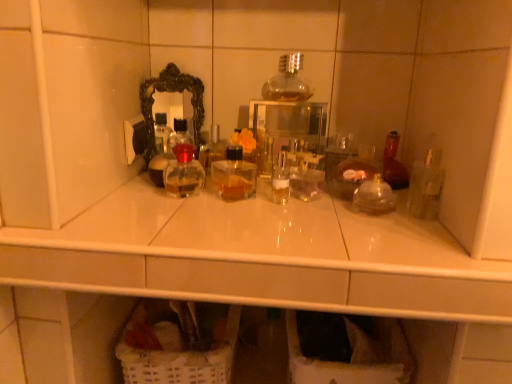
What do you see at coordinates (346, 349) in the screenshot? This screenshot has width=512, height=384. I see `white wicker laundry basket at lower center` at bounding box center [346, 349].

What do you see at coordinates (286, 128) in the screenshot? I see `transparent glass medicine cabinet at center` at bounding box center [286, 128].

Image resolution: width=512 pixels, height=384 pixels. In order to click on white wicker laundry basket at lower center in this screenshot , I will do `click(346, 349)`.

Considering the relative positions of clear glass bottle at center and transparent glass medicine cabinet at center in the image provided, is clear glass bottle at center to the right of transparent glass medicine cabinet at center from the viewer's perspective?

No.

What are the coordinates of `bottle that appears below the transparent glass medicine cabinet at center (from a real-world perspective)` in the screenshot? It's located at (160, 162).

How far apart are clear glass bottle at center and transparent glass medicine cabinet at center?

They are 9.74 inches apart.

Does clear glass bottle at center lie in front of transparent glass medicine cabinet at center?

No.

Is clear glass bottle at center spatially inside black ornate mirror at upper center, or outside of it?

The correct answer is: inside.

Considering the positions of point (170, 154) and point (156, 85), is point (170, 154) closer or farther from the camera than point (156, 85)?

Point (170, 154) appears to be closer to the viewer than point (156, 85).

From the image's perspective, would you say clear glass bottle at center is shown under black ornate mirror at upper center?

Yes, from the image's perspective, clear glass bottle at center is beneath black ornate mirror at upper center.

Is clear glass bottle at center to the left or to the right of black ornate mirror at upper center in the image?

Clearly, clear glass bottle at center is on the left of black ornate mirror at upper center in the image.

What's the angular difference between transparent glass medicine cabinet at center and black ornate mirror at upper center's facing directions?

The angle between the facing direction of transparent glass medicine cabinet at center and the facing direction of black ornate mirror at upper center is 180 degrees.

Considering the points (254, 126) and (191, 90), which point is in front, point (254, 126) or point (191, 90)?

The point (191, 90) is more forward.

The height and width of the screenshot is (384, 512). What are the coordinates of `mirror that is under the transparent glass medicine cabinet at center (from a real-world perspective)` in the screenshot? It's located at (170, 91).

From the image's perspective, is transparent glass medicine cabinet at center under black ornate mirror at upper center?

Yes, from the image's perspective, transparent glass medicine cabinet at center is beneath black ornate mirror at upper center.

Could you tell me if black ornate mirror at upper center is facing clear glass bottle at center?

No, black ornate mirror at upper center is not aimed at clear glass bottle at center.

Would you consider black ornate mirror at upper center to be distant from clear glass bottle at center?

No, black ornate mirror at upper center is not far from clear glass bottle at center.

Is clear glass bottle at center completely or partially inside black ornate mirror at upper center?

Yes, clear glass bottle at center is inside black ornate mirror at upper center.

Which is more to the left, black ornate mirror at upper center or clear glass bottle at center?

From the viewer's perspective, clear glass bottle at center appears more on the left side.

Is clear glass bottle at center not inside white wicker laundry basket at lower center?

Yes, clear glass bottle at center is outside of white wicker laundry basket at lower center.

Is clear glass bottle at center next to white wicker laundry basket at lower center and touching it?

No, clear glass bottle at center is not with white wicker laundry basket at lower center.

Can you confirm if clear glass bottle at center is smaller than white wicker laundry basket at lower center?

Yes, clear glass bottle at center is smaller than white wicker laundry basket at lower center.

Is clear glass bottle at center facing away from white wicker laundry basket at lower center?

No, clear glass bottle at center is not facing away from white wicker laundry basket at lower center.

Which object is further away from the camera taking this photo, transparent glass medicine cabinet at center or clear glass bottle at center?

clear glass bottle at center is further from the camera.

Does transparent glass medicine cabinet at center have a lesser width compared to clear glass bottle at center?

In fact, transparent glass medicine cabinet at center might be wider than clear glass bottle at center.

Locate an element on the screen. medicine cabinet located above the clear glass bottle at center (from a real-world perspective) is located at coordinates click(286, 128).

Can you confirm if white wicker laundry basket at lower center is positioned to the left of black ornate mirror at upper center?

No.

How much distance is there between white wicker laundry basket at lower center and black ornate mirror at upper center?

white wicker laundry basket at lower center is 50.77 centimeters away from black ornate mirror at upper center.

Which is correct: white wicker laundry basket at lower center is inside black ornate mirror at upper center, or outside of it?

white wicker laundry basket at lower center exists outside the volume of black ornate mirror at upper center.

Which object is closer to the camera taking this photo, white wicker laundry basket at lower center or black ornate mirror at upper center?

Positioned in front is white wicker laundry basket at lower center.

This screenshot has height=384, width=512. I want to click on medicine cabinet located on the right of clear glass bottle at center, so click(286, 128).

What are the coordinates of `mirror that appears above the clear glass bottle at center (from a real-world perspective)` in the screenshot? It's located at (170, 91).

From the image, which object appears to be nearer to clear glass bottle at center, white wicker laundry basket at lower center or black ornate mirror at upper center?

The object closer to clear glass bottle at center is black ornate mirror at upper center.

Based on the photo, looking at the image, which one is located further to black ornate mirror at upper center, white wicker laundry basket at lower center or clear glass bottle at center?

Based on the image, white wicker laundry basket at lower center appears to be further to black ornate mirror at upper center.

Based on the photo, considering their positions, is black ornate mirror at upper center positioned closer to transparent glass medicine cabinet at center than clear glass bottle at center?

Based on the image, black ornate mirror at upper center appears to be nearer to transparent glass medicine cabinet at center.

When comparing their distances from black ornate mirror at upper center, does clear glass bottle at center or white wicker laundry basket at lower center seem closer?

clear glass bottle at center.

From the image, which object appears to be nearer to clear glass bottle at center, transparent glass medicine cabinet at center or black ornate mirror at upper center?

black ornate mirror at upper center is closer to clear glass bottle at center.

Looking at the image, which one is located further to clear glass bottle at center, transparent glass medicine cabinet at center or white wicker laundry basket at lower center?

The object further to clear glass bottle at center is white wicker laundry basket at lower center.

When comparing their distances from white wicker laundry basket at lower center, does transparent glass medicine cabinet at center or clear glass bottle at center seem closer?

transparent glass medicine cabinet at center is closer to white wicker laundry basket at lower center.

From the image, which object appears to be farther from white wicker laundry basket at lower center, clear glass bottle at center or transparent glass medicine cabinet at center?

Based on the image, clear glass bottle at center appears to be further to white wicker laundry basket at lower center.

Image resolution: width=512 pixels, height=384 pixels. In order to click on bottle between transparent glass medicine cabinet at center and white wicker laundry basket at lower center in the vertical direction in this screenshot , I will do `click(160, 162)`.

Identify the location of medicine cabinet that lies between black ornate mirror at upper center and white wicker laundry basket at lower center from top to bottom. (286, 128).

This screenshot has height=384, width=512. Find the location of `bottle between black ornate mirror at upper center and white wicker laundry basket at lower center in the up-down direction`. bottle between black ornate mirror at upper center and white wicker laundry basket at lower center in the up-down direction is located at coordinates (160, 162).

Identify the location of mirror between clear glass bottle at center and transparent glass medicine cabinet at center. (170, 91).